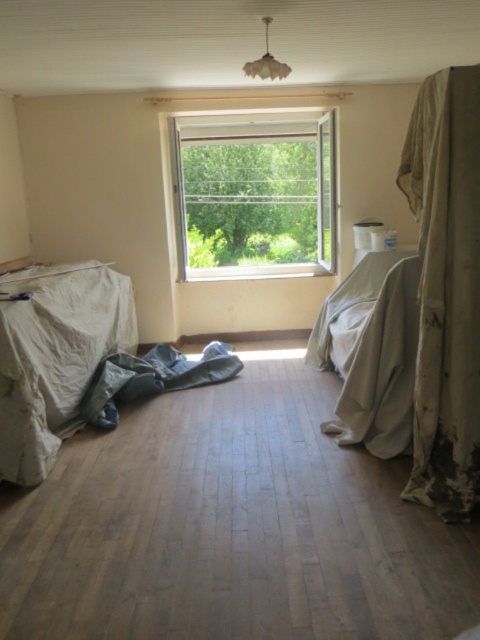
You are a painter who needs to determine which material to use for covering a wall. You have two options from the scene, the worn fabric curtain at right and the clear glass window at center. Which material allows more light to pass through?

The clear glass window at center allows more light to pass through since it is thicker than the worn fabric curtain at right.

You are a painter needing to move a ladder between the worn fabric curtain at right and the white fabric bed at center. The ladder is 1 meter long. Can you fit the ladder horizontally between them?

The distance between the worn fabric curtain at right and the white fabric bed at center is 73.05 centimeters. Since the ladder is 1 meter long, which is longer than the available space, it cannot fit horizontally between them.